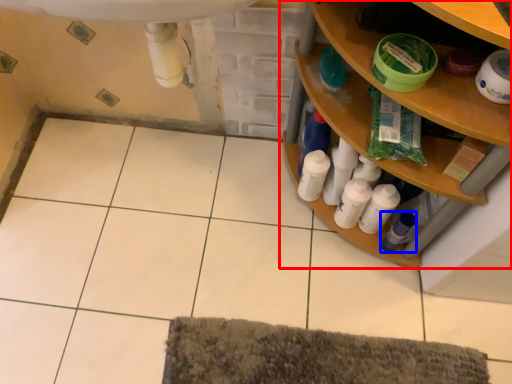
Question: Which point is closer to the camera, shelf (highlighted by a red box) or toiletry (highlighted by a blue box)?

Choices:
 (A) shelf
 (B) toiletry

Answer: (A)